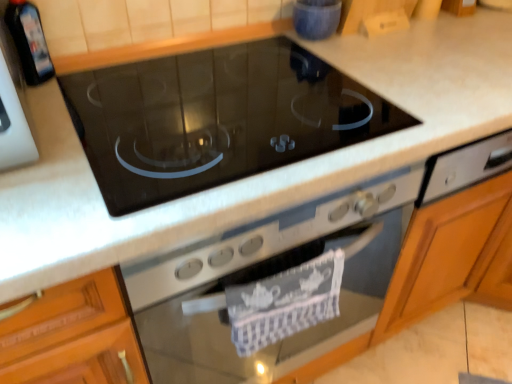
Where is `free spot in front of blue glossy bowl at upper center, positioned as the first appliance in back-to-front order`? The height and width of the screenshot is (384, 512). free spot in front of blue glossy bowl at upper center, positioned as the first appliance in back-to-front order is located at coordinates (340, 61).